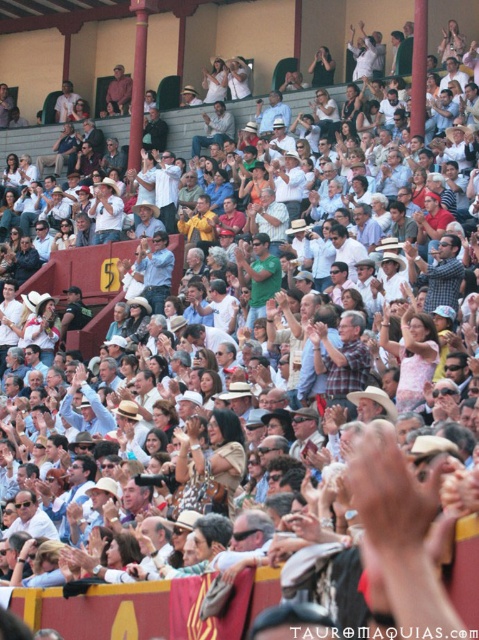
Question: Does green matte shirt at center have a larger size compared to matte white shirt at center?

Choices:
 (A) yes
 (B) no

Answer: (B)

Question: Which point appears closest to the camera in this image?

Choices:
 (A) (251, 314)
 (B) (143, 272)
 (C) (226, 129)
 (D) (123, 93)

Answer: (A)

Question: Which of the following is the closest to the observer?

Choices:
 (A) matte brown shirt at upper center
 (B) green matte shirt at center

Answer: (B)

Question: Is matte white shirt at center to the left of matte brown shirt at upper center from the viewer's perspective?

Choices:
 (A) yes
 (B) no

Answer: (B)

Question: Is green matte shirt at center above matte brown shirt at upper center?

Choices:
 (A) yes
 (B) no

Answer: (B)

Question: Based on their relative distances, which object is nearer to the matte white shirt at center?

Choices:
 (A) matte brown shirt at upper center
 (B) matte blue shirt at center

Answer: (A)